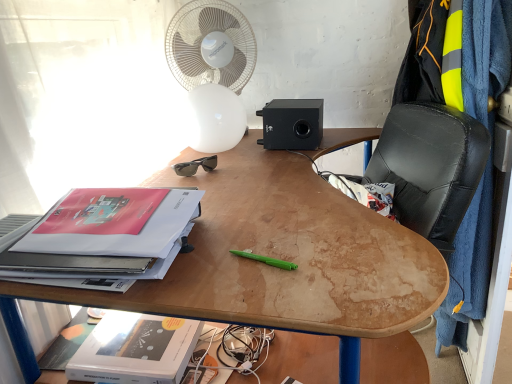
Locate an element on the screen. Image resolution: width=512 pixels, height=384 pixels. spots to the right of matte paper stack at left, the first paperback book in the top-to-bottom sequence is located at coordinates (259, 234).